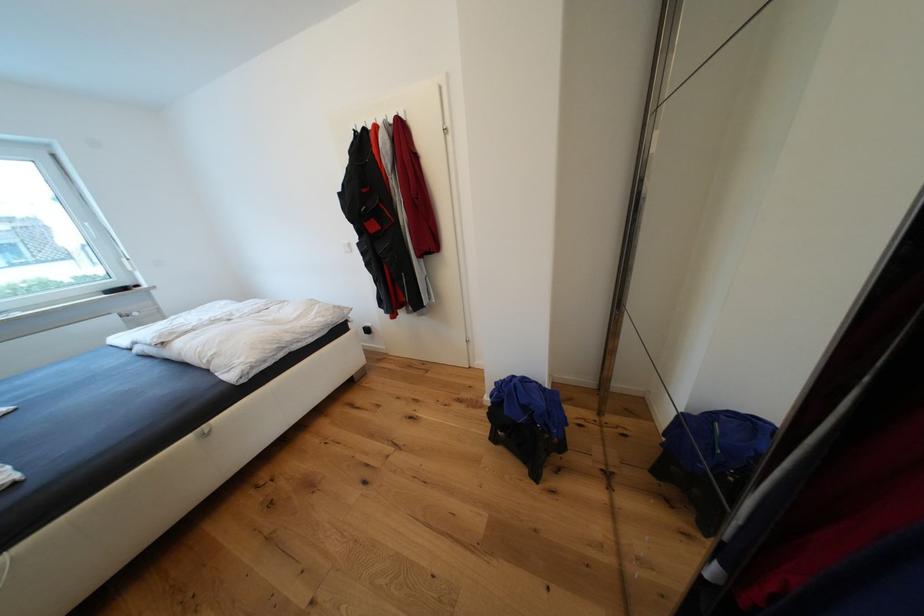
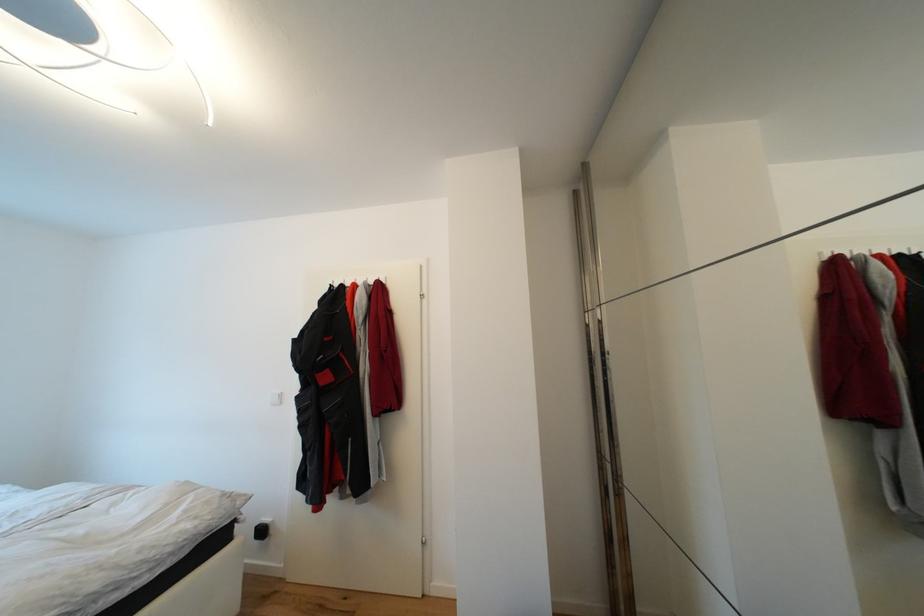
Question: The images are taken continuously from a first-person perspective. In which direction is your viewpoint rotating?

Choices:
 (A) Left
 (B) Right
 (C) Up
 (D) Down

Answer: (C)